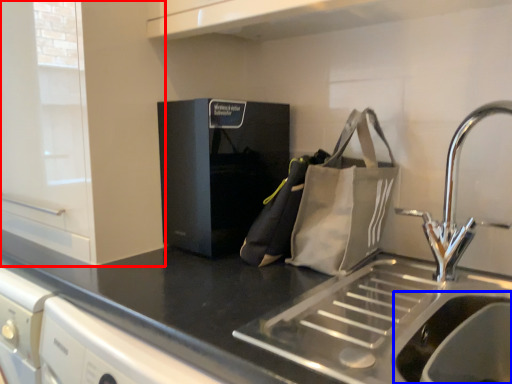
Question: Which of the following is the farthest to the observer, cabinetry (highlighted by a red box) or sink (highlighted by a blue box)?

Choices:
 (A) cabinetry
 (B) sink

Answer: (A)